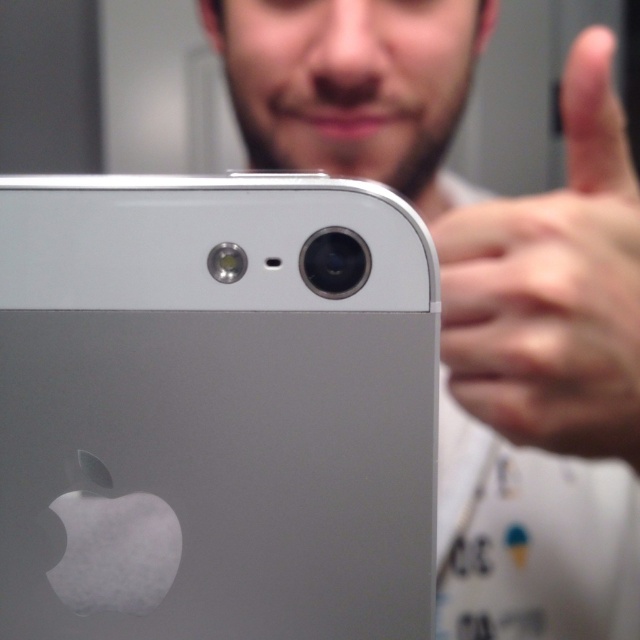
Question: Where is sleek silver phone at center located in relation to matte silver phone at center in the image?

Choices:
 (A) above
 (B) below

Answer: (B)

Question: Which point is closer to the camera taking this photo?

Choices:
 (A) (328, 275)
 (B) (516, 268)

Answer: (A)

Question: Which point appears farthest from the camera in this image?

Choices:
 (A) (259, 237)
 (B) (449, 413)

Answer: (B)

Question: From the image, what is the correct spatial relationship of matte silver phone at center in relation to skinny flesh-toned hand at upper right?

Choices:
 (A) below
 (B) above

Answer: (B)

Question: Is sleek silver phone at center bigger than skinny flesh-toned hand at upper right?

Choices:
 (A) yes
 (B) no

Answer: (B)

Question: Based on their relative distances, which object is farther from the matte silver phone at center?

Choices:
 (A) sleek silver phone at center
 (B) skinny flesh-toned hand at upper right

Answer: (A)